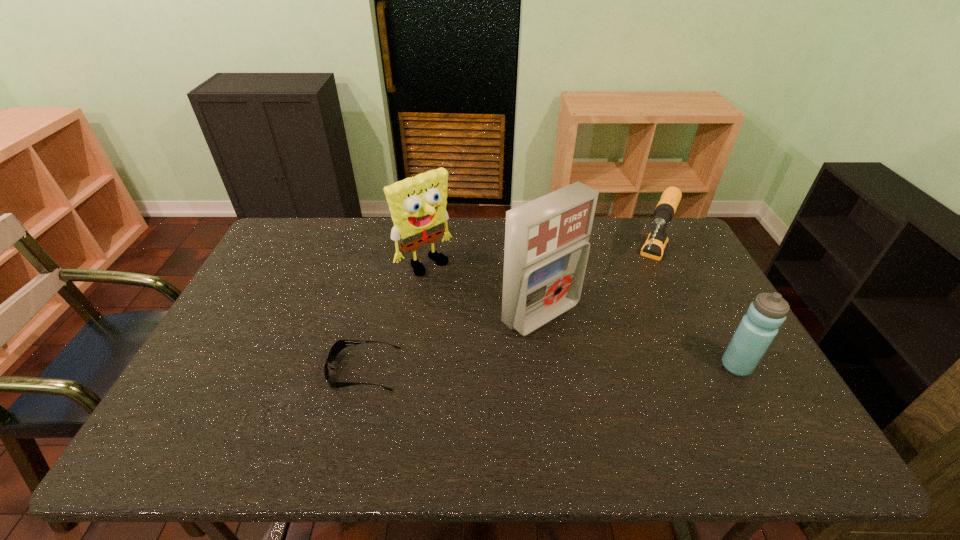
Find the location of `free location located on the face of the sponge`. free location located on the face of the sponge is located at coordinates (476, 308).

Where is `free space located on the face of the sponge`? This screenshot has width=960, height=540. free space located on the face of the sponge is located at coordinates (468, 300).

What are the coordinates of `free space located 0.350m on the face of the sponge` in the screenshot? It's located at (512, 341).

Find the location of a particular element. The width and height of the screenshot is (960, 540). vacant area situated 0.080m on the front-facing side of the first-aid kit is located at coordinates (590, 353).

Locate an element on the screen. This screenshot has width=960, height=540. vacant area situated on the front-facing side of the first-aid kit is located at coordinates (614, 373).

The width and height of the screenshot is (960, 540). What are the coordinates of `vacant space situated on the front-facing side of the first-aid kit` in the screenshot? It's located at (583, 346).

This screenshot has height=540, width=960. Identify the location of free space located 0.330m on the handle side of the second shortest object. (616, 365).

Identify the location of vacant space located 0.160m on the handle side of the second shortest object. This screenshot has height=540, width=960. (634, 323).

Find the location of a particular element. free space located 0.390m on the handle side of the second shortest object is located at coordinates (610, 382).

Identify the location of sponge at the far edge. (x=417, y=204).